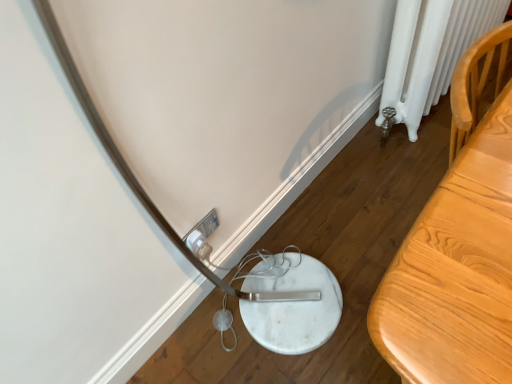
Image resolution: width=512 pixels, height=384 pixels. What do you see at coordinates (430, 52) in the screenshot?
I see `white painted radiator at right` at bounding box center [430, 52].

Describe the element at coordinates (202, 235) in the screenshot. This screenshot has width=512, height=384. I see `white plastic electric outlet at lower center` at that location.

The height and width of the screenshot is (384, 512). Find the location of `light wood table at right`. light wood table at right is located at coordinates pyautogui.click(x=458, y=247).

From the image's perspective, which is above, white plastic electric outlet at lower center or light wood table at right?

light wood table at right, from the image's perspective.

Which of these two, white plastic electric outlet at lower center or light wood table at right, is wider?

Wider between the two is light wood table at right.

From a real-world perspective, is white plastic electric outlet at lower center positioned above or below light wood table at right?

From a real-world perspective, white plastic electric outlet at lower center is physically below light wood table at right.

Can we say white plastic electric outlet at lower center lies outside light wood table at right?

Indeed, white plastic electric outlet at lower center is completely outside light wood table at right.

Is light wood table at right bigger or smaller than white painted radiator at right?

light wood table at right is smaller than white painted radiator at right.

From a real-world perspective, is light wood table at right positioned under white painted radiator at right based on gravity?

No.

Considering the positions of objects light wood table at right and white painted radiator at right in the image provided, who is more to the left, light wood table at right or white painted radiator at right?

light wood table at right is more to the left.

Identify the location of furniture that is below the white painted radiator at right (from the image's perspective). (458, 247).

Can you tell me how much white plastic electric outlet at lower center and white painted radiator at right differ in facing direction?

white plastic electric outlet at lower center and white painted radiator at right are facing 0.897 degrees away from each other.

From a real-world perspective, which object rests below the other?

white plastic electric outlet at lower center is physically lower.

Is white plastic electric outlet at lower center next to white painted radiator at right and touching it?

white plastic electric outlet at lower center is not next to white painted radiator at right, and they're not touching.

Looking at this image, which point is more forward, (194,232) or (452,19)?

The point (194,232) is closer.

Considering the sizes of objects white painted radiator at right and light wood table at right in the image provided, who is smaller, white painted radiator at right or light wood table at right?

light wood table at right is smaller.

Between white painted radiator at right and light wood table at right, which one has less height?

Standing shorter between the two is white painted radiator at right.

Would you consider white painted radiator at right to be distant from light wood table at right?

No.

Is light wood table at right thinner than white plastic electric outlet at lower center?

In fact, light wood table at right might be wider than white plastic electric outlet at lower center.

From a real-world perspective, is light wood table at right on white plastic electric outlet at lower center?

Yes.

Which object is more forward, light wood table at right or white plastic electric outlet at lower center?

light wood table at right is more forward.

Choose the correct answer: Is light wood table at right inside white plastic electric outlet at lower center or outside it?

light wood table at right is not enclosed by white plastic electric outlet at lower center.

From a real-world perspective, between white painted radiator at right and white plastic electric outlet at lower center, who is vertically higher?

In real-world perspective, white painted radiator at right is above.

From the image's perspective, is white painted radiator at right located above white plastic electric outlet at lower center?

Yes.

Based on their sizes in the image, would you say white painted radiator at right is bigger or smaller than white plastic electric outlet at lower center?

In the image, white painted radiator at right appears to be larger than white plastic electric outlet at lower center.

Choose the correct answer: Is white painted radiator at right inside white plastic electric outlet at lower center or outside it?

white painted radiator at right is located beyond the bounds of white plastic electric outlet at lower center.

At what (x,y) coordinates should I click in order to perform the action: click on electric outlet behind the light wood table at right. Please return your answer as a coordinate pair (x, y). Looking at the image, I should click on (202, 235).

You are a GUI agent. You are given a task and a screenshot of the screen. Output one action in this format:
    pyautogui.click(x=<x>, y=<y>)
    Task: Click on the furniture in front of the white painted radiator at right
    The height and width of the screenshot is (384, 512).
    Given the screenshot: What is the action you would take?
    coord(458,247)

Estimate the real-world distances between objects in this image. Which object is closer to white painted radiator at right, light wood table at right or white plastic electric outlet at lower center?

light wood table at right.

Considering their positions, is white plastic electric outlet at lower center positioned closer to light wood table at right than white painted radiator at right?

The object closer to light wood table at right is white painted radiator at right.

Looking at the image, which one is located closer to white plastic electric outlet at lower center, light wood table at right or white painted radiator at right?

The object closer to white plastic electric outlet at lower center is light wood table at right.

Based on their spatial positions, is white painted radiator at right or light wood table at right further from white plastic electric outlet at lower center?

Among the two, white painted radiator at right is located further to white plastic electric outlet at lower center.

Based on their spatial positions, is white painted radiator at right or white plastic electric outlet at lower center closer to light wood table at right?

Among the two, white painted radiator at right is located nearer to light wood table at right.

Based on the photo, which object lies further to the anchor point white painted radiator at right, white plastic electric outlet at lower center or light wood table at right?

Among the two, white plastic electric outlet at lower center is located further to white painted radiator at right.

Image resolution: width=512 pixels, height=384 pixels. Identify the location of furniture situated between white plastic electric outlet at lower center and white painted radiator at right from left to right. (458, 247).